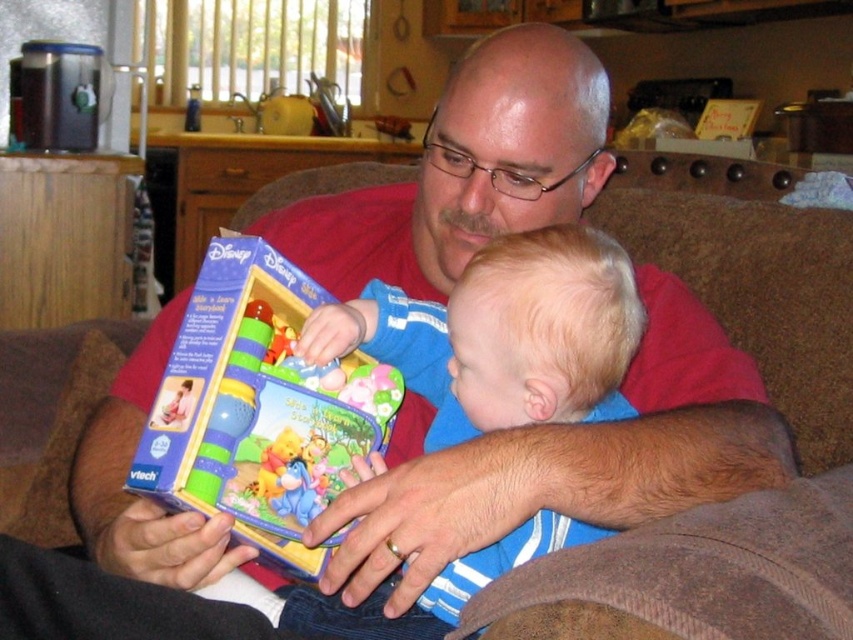
You are standing in the living room and see the adult and child interacting with the VTech learning toy box. Where is the blue striped shirt at center located relative to the point at coordinates (503,333)?

The blue striped shirt at center is located exactly at the coordinates (503,333).

Where is the blue striped shirt at center located in the image?

The blue striped shirt at center is located at point coordinates of approximately (503, 333).

You are a photographer standing in front of the scene. You want to take a photo of the blue striped shirt at center and the matte plastic toy at center. Which object should you focus on first if you want to capture both in the same frame without moving the camera?

The blue striped shirt at center is much taller than the matte plastic toy at center, so you should focus on the blue striped shirt at center first to ensure it is in clear view before adjusting the camera settings for the smaller toy.